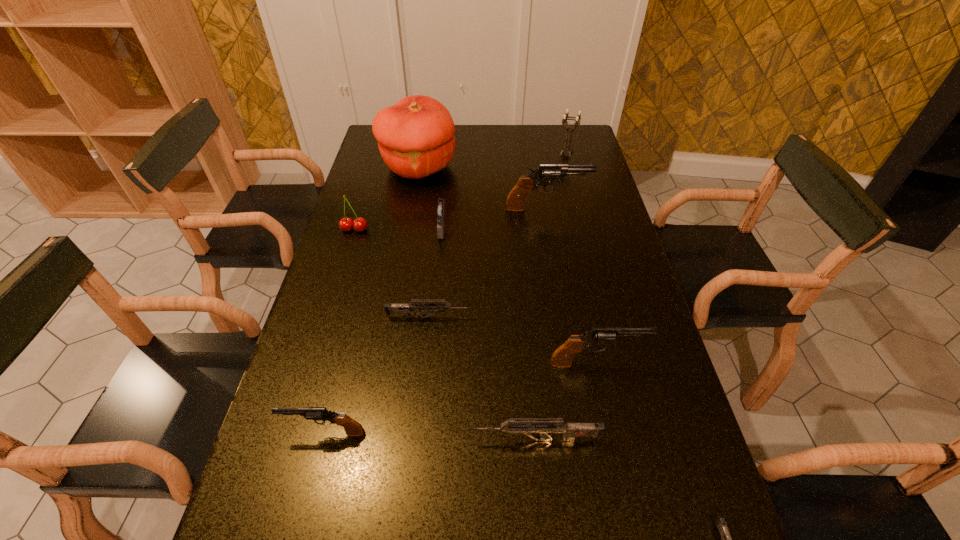
Where is `pumpkin`? pumpkin is located at coordinates (415, 136).

Image resolution: width=960 pixels, height=540 pixels. What are the coordinates of `the tallest gun` in the screenshot? It's located at (547, 174).

Image resolution: width=960 pixels, height=540 pixels. I want to click on the farthest gun, so [x=547, y=174].

Where is `candle holder`? This screenshot has height=540, width=960. candle holder is located at coordinates (564, 121).

Locate an element on the screen. This screenshot has height=540, width=960. the second farthest black gun is located at coordinates (562, 357).

Where is `the fourth tallest object`? This screenshot has width=960, height=540. the fourth tallest object is located at coordinates (562, 357).

I want to click on igniter, so click(x=439, y=211).

Identify the location of cherry. The width and height of the screenshot is (960, 540). (346, 224).

Locate an element on the screen. Image resolution: width=960 pixels, height=540 pixels. the fourth shortest gun is located at coordinates (352, 428).

The width and height of the screenshot is (960, 540). Identify the location of the nearest black gun. (352, 428).